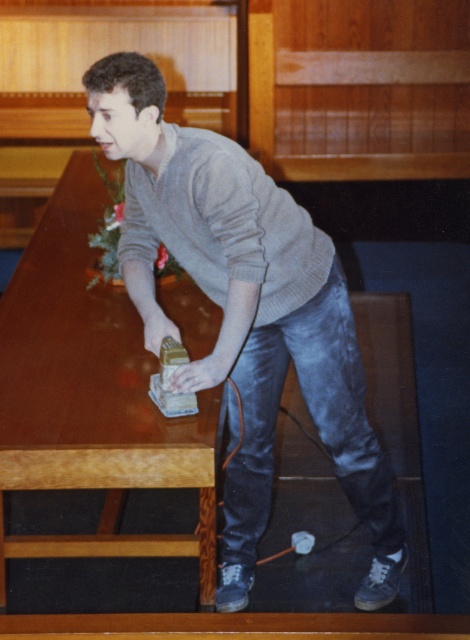
You are a person who wants to place a 20 inch wide box on the shiny brown wood table at center. Considering the gray wool sweater at center is in the way, can you fit the box on the table without moving the sweater?

The gray wool sweater at center is 22.05 inches away from the shiny brown wood table at center. Since the box is 20 inches wide and the distance between the sweater and the table is 22.05 inches, there is enough space to place the box on the shiny brown wood table at center without moving the sweater.

Consider the image. You are standing at the origin point in the workshop. There are two points marked in the scene. The first point is at coordinates point (236, 545) and the second is at point (192, 458). If you want to reach the point that is further away from you, which coordinate should you head towards?

Point (236, 545) is behind point (192, 458), so to reach the point further away from you, you should head towards point (236, 545).

You are organizing a space for a woodworking class and need to ensure there is enough room for participants. Given the gray wool sweater at center and the shiny brown wood table at center, which object takes up more space in the scene?

The shiny brown wood table at center takes up more space than the gray wool sweater at center.